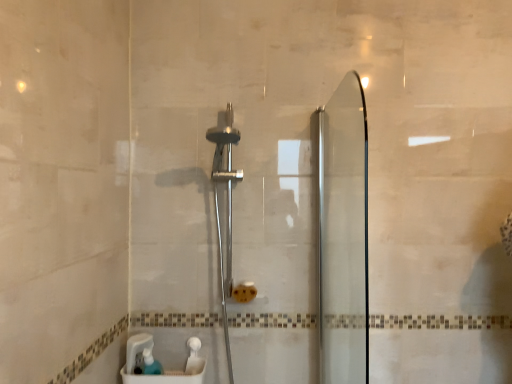
Question: Is polished chrome shower head at center in front of or behind transparent glass screen door at right in the image?

Choices:
 (A) front
 (B) behind

Answer: (B)

Question: Which is correct: polished chrome shower head at center is inside transparent glass screen door at right, or outside of it?

Choices:
 (A) inside
 (B) outside

Answer: (B)

Question: Estimate the real-world distances between objects in this image. Which object is closer to the translucent plastic soap dispenser at lower left?

Choices:
 (A) transparent glass screen door at right
 (B) translucent plastic container at lower center
 (C) polished chrome shower head at center

Answer: (B)

Question: Which object is positioned farthest from the polished chrome shower head at center?

Choices:
 (A) translucent plastic soap dispenser at lower left
 (B) translucent plastic container at lower center
 (C) transparent glass screen door at right

Answer: (A)